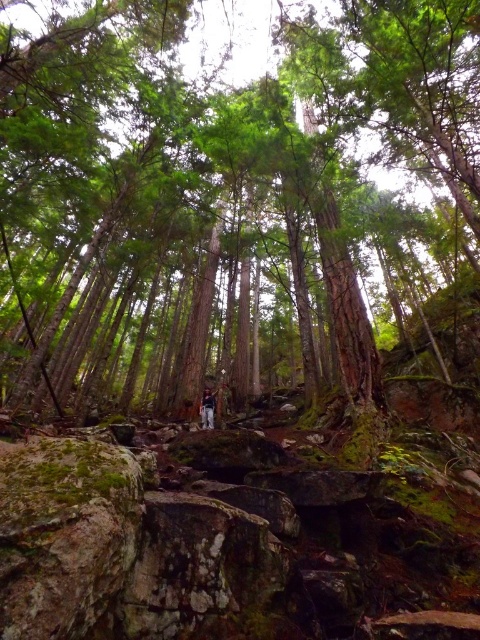
You are a hiker who has just spotted the green rough bark tree at center and the dark blue jeans at center in the forest. From your current position, which object is located to the right side?

The green rough bark tree at center is located to the right of the dark blue jeans at center.

You are standing in the forest and want to locate the green rough bark tree at center. According to the coordinates provided, where should you look relative to your current position?

The green rough bark tree at center is located at coordinates point (223, 195), which means it is positioned slightly to the right and above your current viewpoint.

Consider the image. You are standing in a forest and want to reach a specific point marked as point (130, 54). If you walk straight ahead, how far will you have to travel to reach that point?

The distance between point (130, 54) and the camera is 14.08 meters, so you will have to walk 14.08 meters straight ahead to reach it.